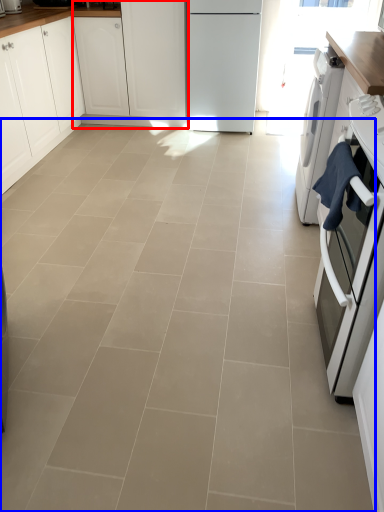
Question: Which point is closer to the camera, cabinetry (highlighted by a red box) or ceramic tile (highlighted by a blue box)?

Choices:
 (A) cabinetry
 (B) ceramic tile

Answer: (B)